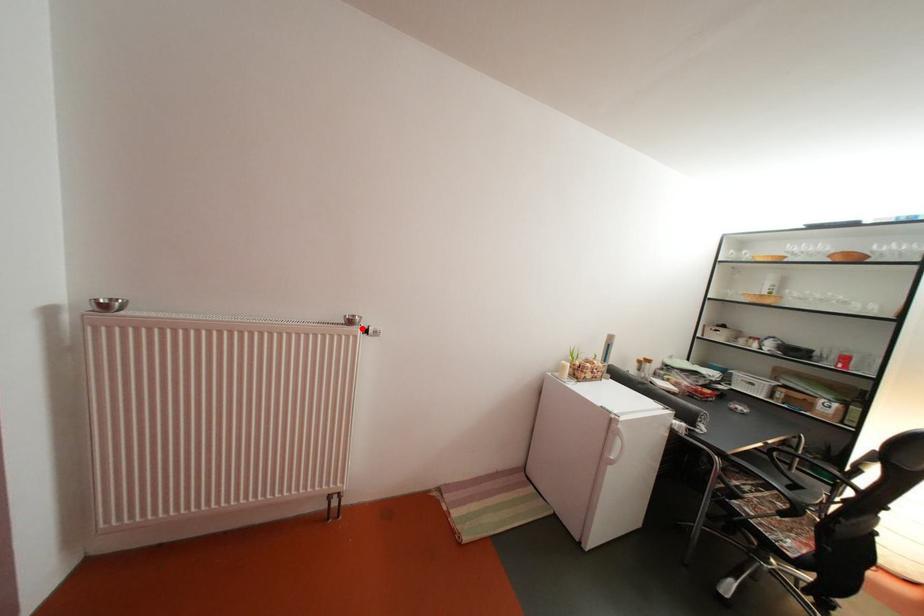
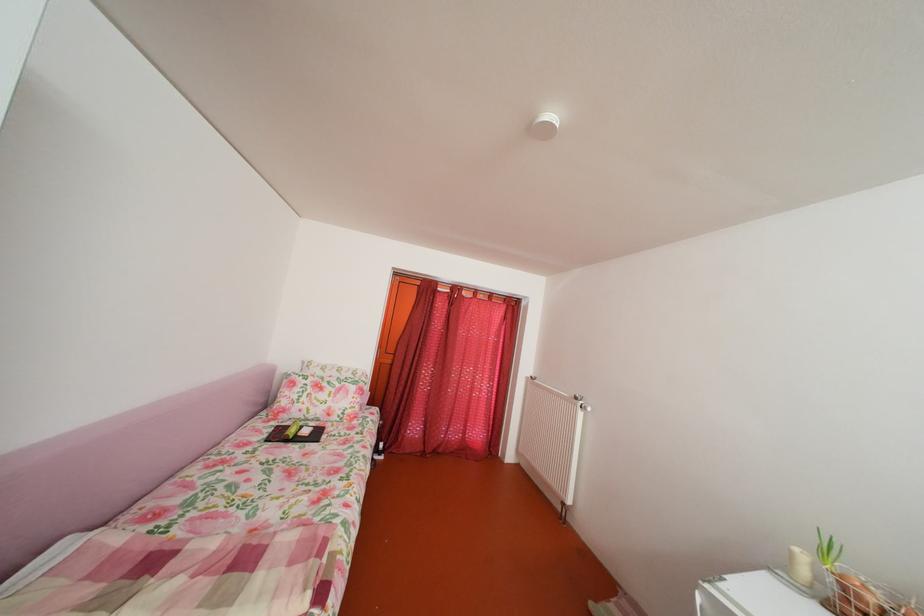
Find the pixel in the second image that matches the highlighted location in the first image.

(588, 405)